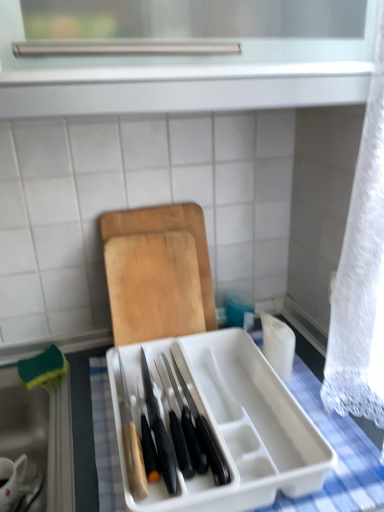
Image resolution: width=384 pixels, height=512 pixels. What are the coordinates of `white ceramic mug at lower left` in the screenshot? It's located at (18, 484).

I want to click on wooden cutting board at center, so (158, 273).

Considering the sizes of white plastic knife block at center and wooden cutting board at center in the image, is white plastic knife block at center taller or shorter than wooden cutting board at center?

Considering their sizes, white plastic knife block at center has less height than wooden cutting board at center.

Is wooden cutting board at center surrounded by white plastic knife block at center?

No.

Where is `appliance lying in front of the wooden cutting board at center`? appliance lying in front of the wooden cutting board at center is located at coordinates pos(228,423).

Is wooden cutting board at center beside white ceramic mug at lower left?

wooden cutting board at center and white ceramic mug at lower left are not in contact.

Considering the relative sizes of wooden cutting board at center and white ceramic mug at lower left in the image provided, is wooden cutting board at center thinner than white ceramic mug at lower left?

Yes, wooden cutting board at center is thinner than white ceramic mug at lower left.

From the image's perspective, is wooden cutting board at center located beneath white ceramic mug at lower left?

No, from the image's perspective, wooden cutting board at center is not beneath white ceramic mug at lower left.

Is white ceramic mug at lower left positioned with its back to wooden cutting board at center?

white ceramic mug at lower left is not turned away from wooden cutting board at center.

From the picture: From the image's perspective, which one is positioned higher, white ceramic mug at lower left or wooden cutting board at center?

From the image's view, wooden cutting board at center is above.

You are a GUI agent. You are given a task and a screenshot of the screen. Output one action in this format:
    pyautogui.click(x=<x>, y=<y>)
    Task: Click on the tableware in front of the wooden cutting board at center
    The height and width of the screenshot is (512, 384).
    Given the screenshot: What is the action you would take?
    pyautogui.click(x=18, y=484)

Can you tell me how much white ceramic mug at lower left and wooden cutting board at center differ in facing direction?

The angular difference between white ceramic mug at lower left and wooden cutting board at center is 2.34 degrees.

Is white ceramic mug at lower left facing away from white plastic knife block at center?

No, white ceramic mug at lower left is not facing away from white plastic knife block at center.

Is white ceramic mug at lower left not inside white plastic knife block at center?

That's correct, white ceramic mug at lower left is outside of white plastic knife block at center.

Considering their positions, is white ceramic mug at lower left located in front of or behind white plastic knife block at center?

Clearly, white ceramic mug at lower left is behind white plastic knife block at center.

Does wooden cutting board at center have a greater height compared to white plastic knife block at center?

Yes.

Is wooden cutting board at center positioned behind white plastic knife block at center?

Yes, the depth of wooden cutting board at center is greater than that of white plastic knife block at center.

From a real-world perspective, is wooden cutting board at center above or below white plastic knife block at center?

wooden cutting board at center is situated higher than white plastic knife block at center in the real world.

Between wooden cutting board at center and white plastic knife block at center, which one has smaller width?

With smaller width is wooden cutting board at center.

From the image's perspective, is white plastic knife block at center above or below white ceramic mug at lower left?

white plastic knife block at center is above white ceramic mug at lower left.

Is white plastic knife block at center facing towards white ceramic mug at lower left?

No, white plastic knife block at center is not facing towards white ceramic mug at lower left.

Is white plastic knife block at center spatially inside white ceramic mug at lower left, or outside of it?

white plastic knife block at center is not inside white ceramic mug at lower left, it's outside.

Considering the relative sizes of white plastic knife block at center and white ceramic mug at lower left in the image provided, is white plastic knife block at center taller than white ceramic mug at lower left?

No, white plastic knife block at center is not taller than white ceramic mug at lower left.

Locate an element on the screen. The height and width of the screenshot is (512, 384). cutting board behind the white plastic knife block at center is located at coordinates (158, 273).

The height and width of the screenshot is (512, 384). Find the location of `tableware that is on the left side of wooden cutting board at center`. tableware that is on the left side of wooden cutting board at center is located at coordinates (18, 484).

Which object lies nearer to the anchor point white ceramic mug at lower left, wooden cutting board at center or white plastic knife block at center?

white plastic knife block at center.

When comparing their distances from wooden cutting board at center, does white plastic knife block at center or white ceramic mug at lower left seem further?

white ceramic mug at lower left is positioned further to the anchor wooden cutting board at center.

When comparing their distances from white plastic knife block at center, does wooden cutting board at center or white ceramic mug at lower left seem further?

white ceramic mug at lower left.

Looking at the image, which one is located further to wooden cutting board at center, white ceramic mug at lower left or white plastic knife block at center?

The object further to wooden cutting board at center is white ceramic mug at lower left.

Which object lies nearer to the anchor point white ceramic mug at lower left, white plastic knife block at center or wooden cutting board at center?

Among the two, white plastic knife block at center is located nearer to white ceramic mug at lower left.

Estimate the real-world distances between objects in this image. Which object is closer to white plastic knife block at center, white ceramic mug at lower left or wooden cutting board at center?

wooden cutting board at center is positioned closer to the anchor white plastic knife block at center.

Find the location of a particular element. The height and width of the screenshot is (512, 384). cutting board between white ceramic mug at lower left and white plastic knife block at center is located at coordinates (158, 273).